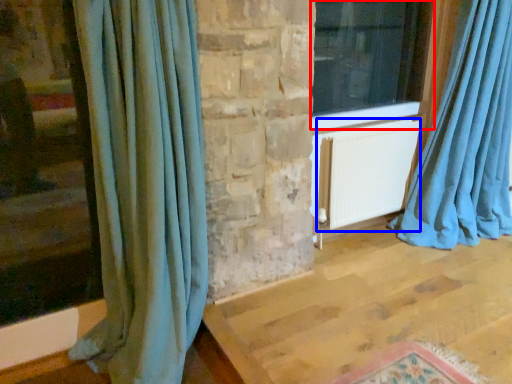
Question: Among these objects, which one is nearest to the camera, window (highlighted by a red box) or radiator (highlighted by a blue box)?

Choices:
 (A) window
 (B) radiator

Answer: (A)